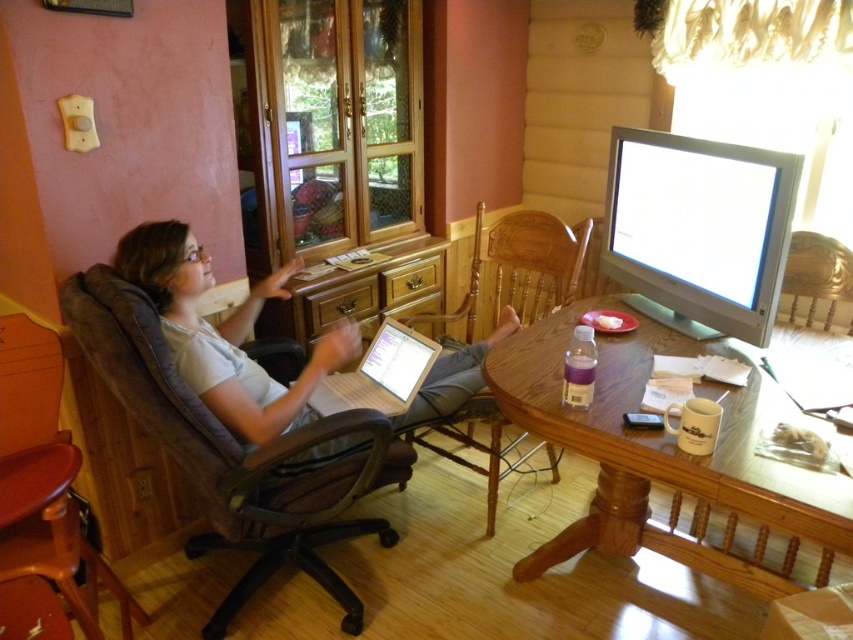
You are organizing a meeting in this room and need to position two chairs so that one faces the door and the other faces the window. Given the current arrangement, can you place the wooden swivel chair at left and the brown wood chair at center in such a way that they face opposite directions without moving the table?

The wooden swivel chair at left is in front of the brown wood chair at center, so you can rotate them to face opposite directions as long as their positions relative to each other remain unchanged. This way, they can face the door and window respectively without moving the table.

Looking at this image, you are standing in the room and want to determine which of the two points, point (103, 365) or point (65, 536), is closer to you. Based on the scene description, which point is nearer?

Point (103, 365) is closer to the viewer than point (65, 536).